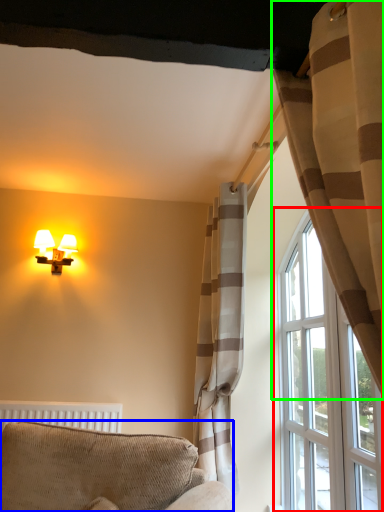
Question: Which object is the closest to the window (highlighted by a red box)? Choose among these: furniture (highlighted by a blue box) or curtain (highlighted by a green box).

Choices:
 (A) furniture
 (B) curtain

Answer: (A)